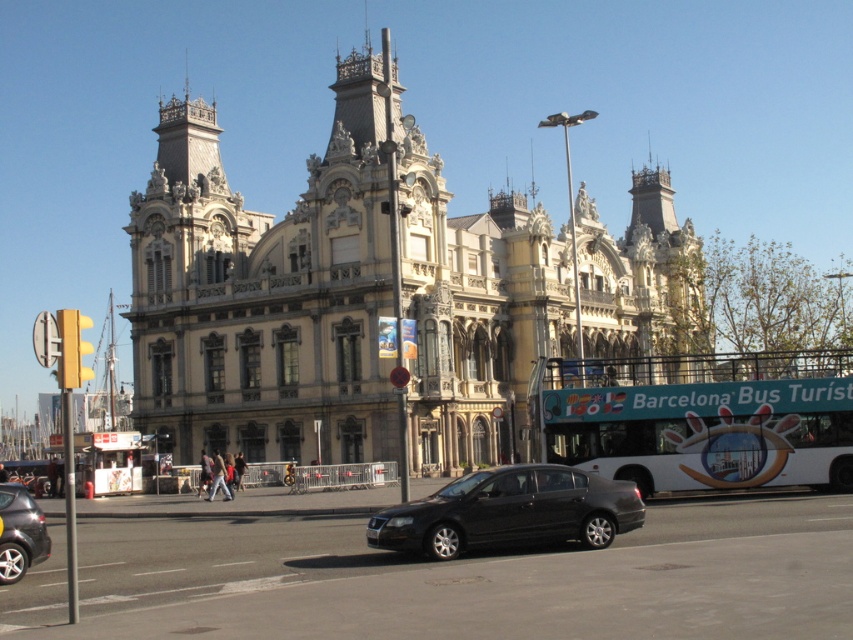
You are a pedestrian standing at the crosswalk in front of the grand ornate building. You want to cross the street to the other side. The crosswalk is between the matte black sedan at center and the metallic gray sedan at lower left. Which direction should you walk to avoid the parked cars?

You should walk towards the metallic gray sedan at lower left because it is behind the matte black sedan at center, so there is a clear path between them.

You are a pedestrian standing on the sidewalk in front of the grand building. You need to cross the street to reach the other side. There is a white glossy bus at lower right and a metallic gray sedan at lower left. Which vehicle should you avoid stepping over while crossing?

You should avoid stepping over the white glossy bus at lower right because it is positioned on the right side of the metallic gray sedan at lower left, meaning it is further to your right as you cross the street.

Consider the image. You are standing on the sidewalk in front of the stone textured building at center. You want to take a photo of the entire building without any obstructions. Is the black sedan parked on the right side of the road blocking your view? Please explain.

The stone textured building at center is 67.71 meters away from the viewer. Since the black sedan is parked on the right side of the road, it might be positioned to the side and not directly in front, so it likely does not block the view of the entire building. However, without specific information about the sedan location relative to the building, this is an assumption based on typical street layouts.